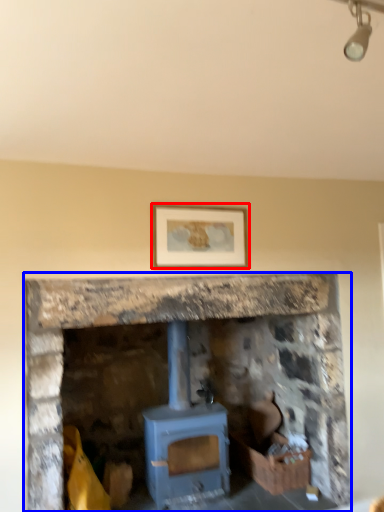
Question: Among these objects, which one is nearest to the camera, picture frame (highlighted by a red box) or fireplace (highlighted by a blue box)?

Choices:
 (A) picture frame
 (B) fireplace

Answer: (B)